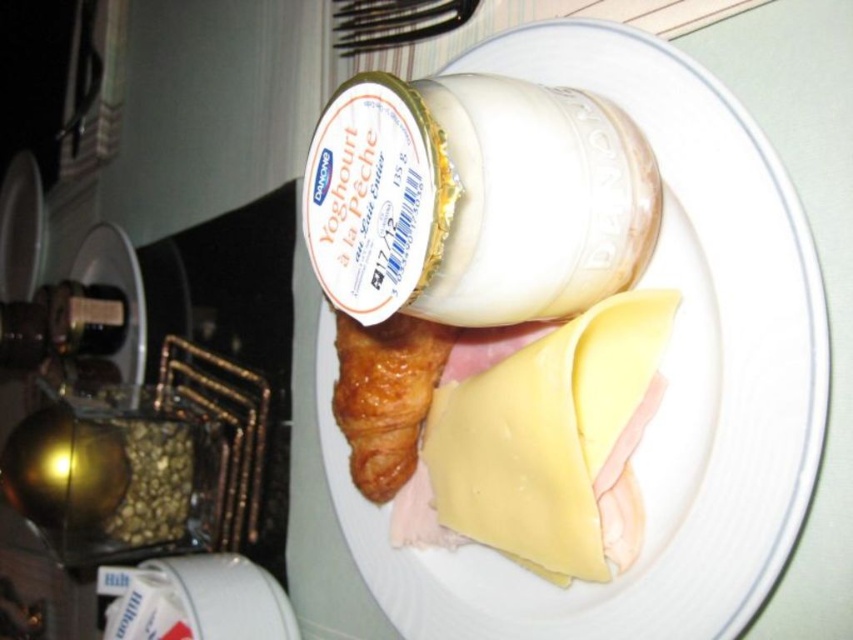
You are a food delivery person who needs to place a small note between the white matte yogurt container at upper center and the yellow cheese at center. The note is 2 inches wide. Can you fit it there?

The white matte yogurt container at upper center is 4.08 inches away from the yellow cheese at center. Since the note is 2 inches wide, it can fit between them as there is enough space.

You are a food critic inspecting the plate. You need to determine which item on the plate is taller between the yellow cheese at center and the golden brown flaky croissant at center. Based on the description, which one is taller?

The yellow cheese at center has a greater height compared to the golden brown flaky croissant at center, so the yellow cheese at center is taller.